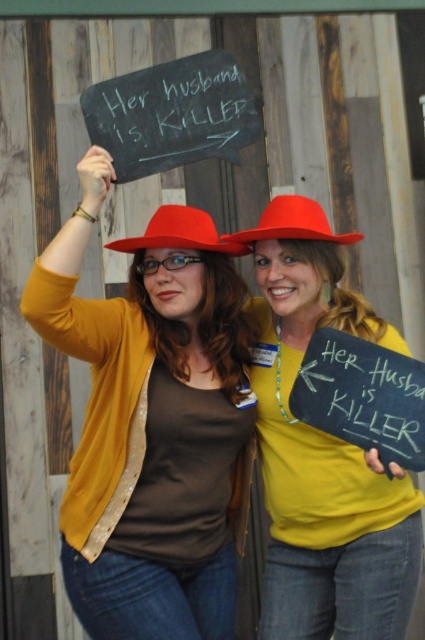
You are a photographer taking a picture of the scene. You notice the black chalkboard at upper center and the matte red hat at center. Which object is positioned higher in the image?

The black chalkboard at upper center is positioned higher than the matte red hat at center.

You are an observer looking at the scene. Which object is taller, the matte yellow shirt at center or the black chalkboard at upper center?

The matte yellow shirt at center is much taller than the black chalkboard at upper center.

You are taking a photo of the two people in the scene. You want to focus on the point that is closer to the camera. Which point should you choose between point (215, 488) and point (396, 577)?

Point (215, 488) is further to the camera than point (396, 577), so to focus on the closer point, you should choose point (396, 577).